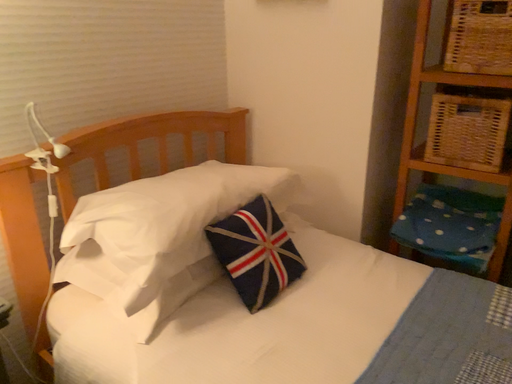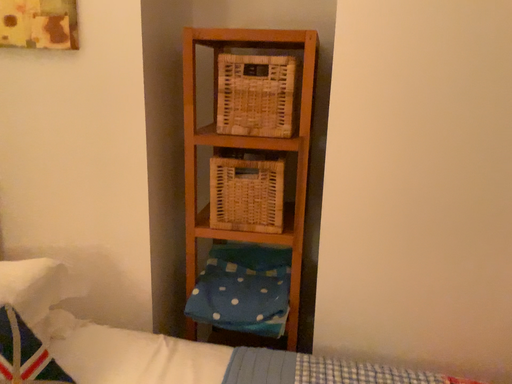
Question: How did the camera likely rotate when shooting the video?

Choices:
 (A) rotated upward
 (B) rotated downward

Answer: (A)